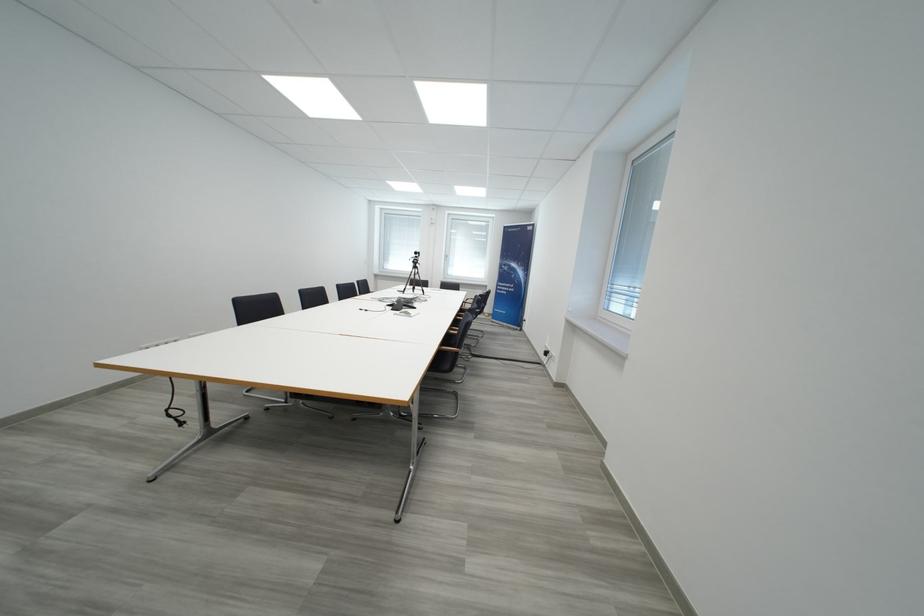
Locate an element on the screen. The image size is (924, 616). conference phone is located at coordinates (402, 305).